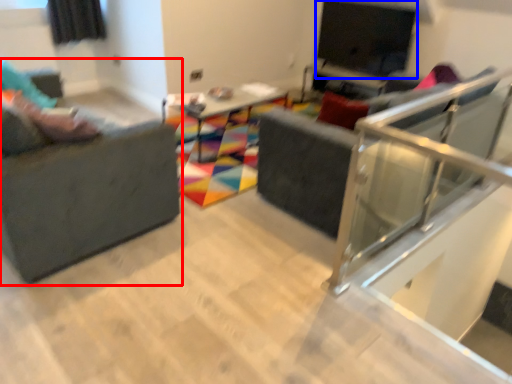
Question: Among these objects, which one is nearest to the camera, studio couch (highlighted by a red box) or window screen (highlighted by a blue box)?

Choices:
 (A) studio couch
 (B) window screen

Answer: (A)